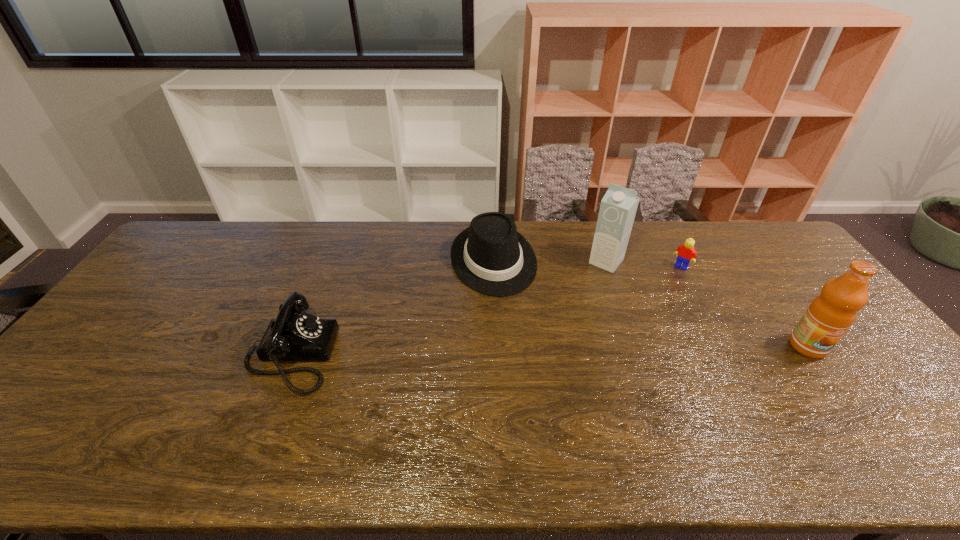
You are a GUI agent. You are given a task and a screenshot of the screen. Output one action in this format:
    pyautogui.click(x=<x>, y=<y>)
    Task: Click on the free region that satisfies the following two spatial constraints: 1. on the front side of the third object from right to left; 2. on the left side of the fourth object from right to left
    
    Given the screenshot: What is the action you would take?
    pyautogui.click(x=493, y=262)